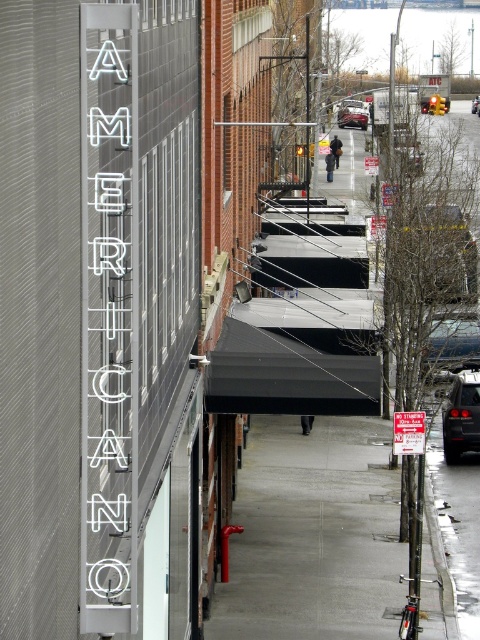
You are a pedestrian standing at the intersection looking down the street. You see a shiny black car at center right and a shiny black sedan at center. Which vehicle is closer to you?

The shiny black car at center right is closer to the viewer than the shiny black sedan at center.

Looking at this image, you are a delivery person who needs to park your 1.8 meter wide van between the red plastic sign at center and the shiny black sedan at center. Can your van fit in the space between them?

The red plastic sign at center is narrower than the shiny black sedan at center. However, the exact distance between them isn not specified. Without knowing the space between the two objects, it is impossible to determine if the van can fit.